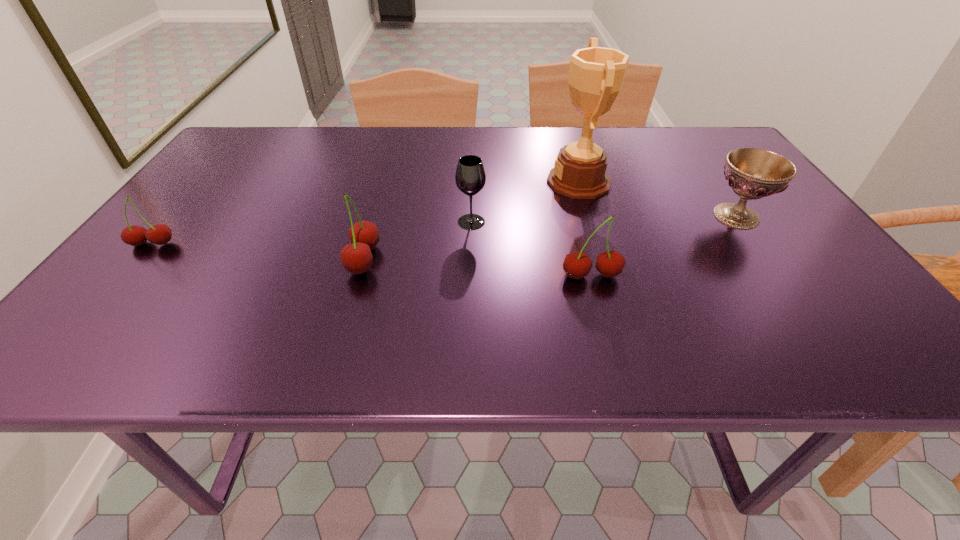
At what (x,y) coordinates should I click in order to perform the action: click on the leftmost object. Please return your answer as a coordinate pair (x, y). The image size is (960, 540). Looking at the image, I should click on (159, 234).

I want to click on the shortest cherry, so click(159, 234).

At what (x,y) coordinates should I click in order to perform the action: click on the second cherry from left to right. Please return your answer as a coordinate pair (x, y). Looking at the image, I should click on (356, 257).

Identify the location of the second tallest cherry. The width and height of the screenshot is (960, 540). (577, 265).

The height and width of the screenshot is (540, 960). Identify the location of chalice. (752, 173).

What are the coordinates of `the fourth object from right to left` in the screenshot? It's located at (470, 177).

Identify the location of award. (x=596, y=74).

Where is `vacant space situated on the surface of the leftmost object`? The image size is (960, 540). vacant space situated on the surface of the leftmost object is located at coordinates (94, 314).

I want to click on vacant space positioned on the surface of the second cherry from left to right, so click(x=181, y=259).

Where is `free point located 0.210m on the surface of the second cherry from left to right`? This screenshot has width=960, height=540. free point located 0.210m on the surface of the second cherry from left to right is located at coordinates (248, 259).